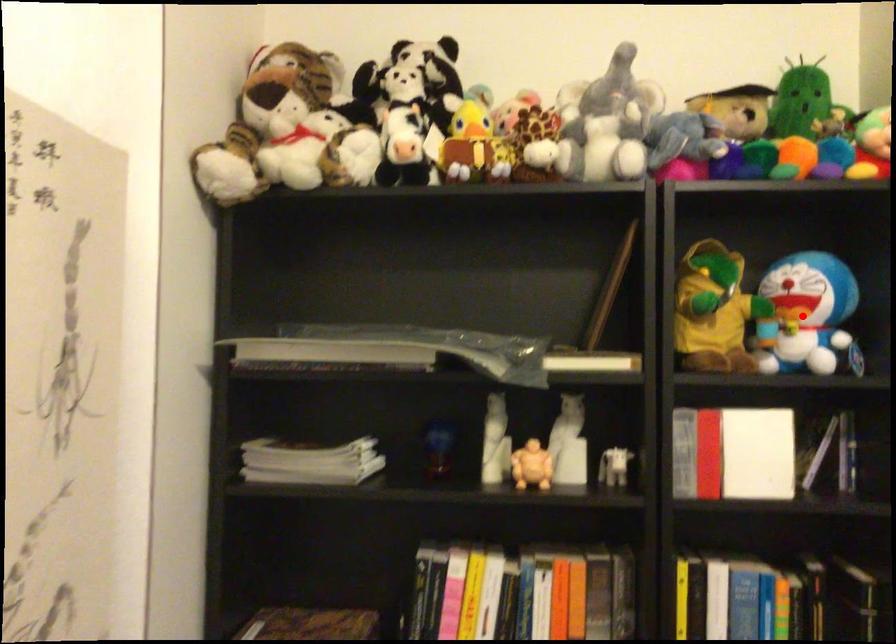
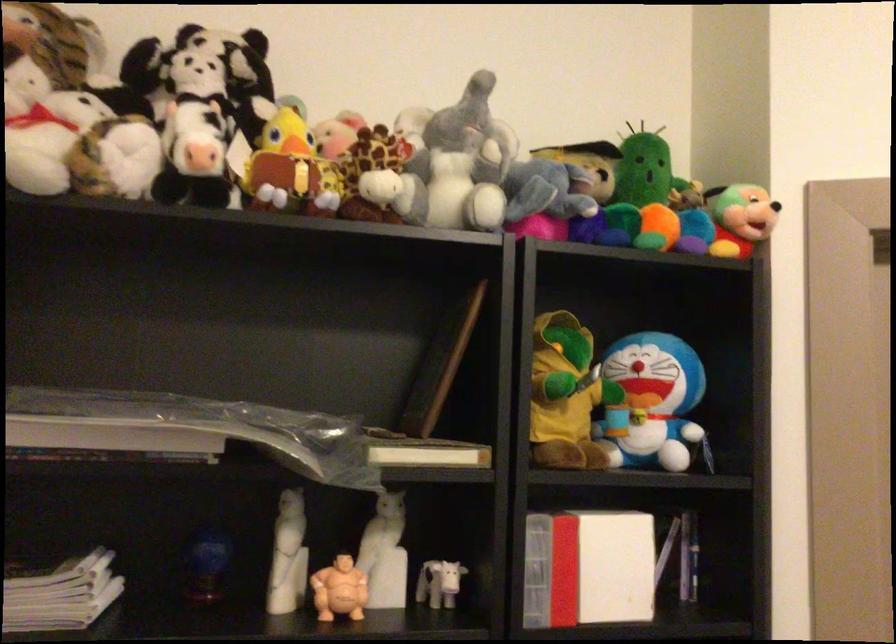
Locate, in the second image, the point that corresponds to the highlighted location in the first image.

(651, 402)